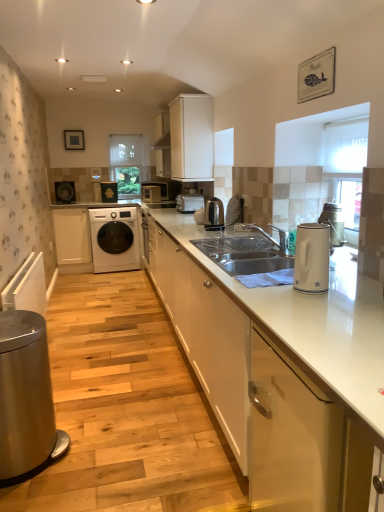
The height and width of the screenshot is (512, 384). I want to click on free location in front of satin nickel kettle at center, which is the fourth appliance in left-to-right order, so click(x=211, y=233).